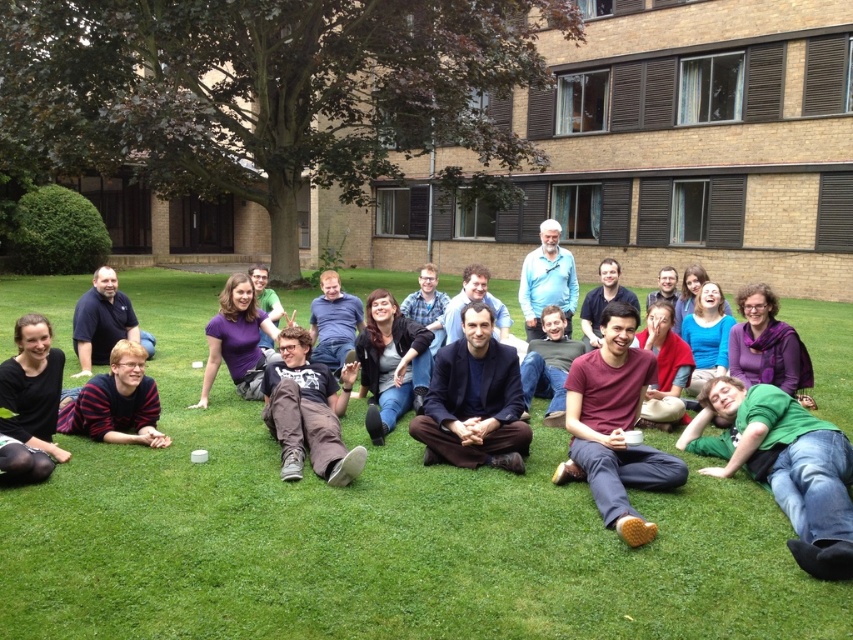
Can you confirm if green cotton shirt at lower right is smaller than dark blue fabric at center?

Incorrect, green cotton shirt at lower right is not smaller in size than dark blue fabric at center.

Does green cotton shirt at lower right come in front of dark blue fabric at center?

Yes, green cotton shirt at lower right is closer to the viewer.

This screenshot has height=640, width=853. What do you see at coordinates (784, 465) in the screenshot?
I see `green cotton shirt at lower right` at bounding box center [784, 465].

Locate an element on the screen. The height and width of the screenshot is (640, 853). green cotton shirt at lower right is located at coordinates click(x=784, y=465).

Can you confirm if green grass at center is positioned above green cotton shirt at lower right?

Yes, green grass at center is above green cotton shirt at lower right.

Can you confirm if green grass at center is bigger than green cotton shirt at lower right?

Yes.

Who is more distant from viewer, (198, 312) or (822, 477)?

Point (198, 312)

At what (x,y) coordinates should I click in order to perform the action: click on green grass at center. Please return your answer as a coordinate pair (x, y). The width and height of the screenshot is (853, 640). Looking at the image, I should click on (372, 534).

Does maroon cotton shirt at center appear on the right side of matte black shirt at left?

Yes, maroon cotton shirt at center is to the right of matte black shirt at left.

Image resolution: width=853 pixels, height=640 pixels. What are the coordinates of `maroon cotton shirt at center` in the screenshot? It's located at (614, 426).

Who is more forward, (587,438) or (109,321)?

Point (587,438)

Locate an element on the screen. maroon cotton shirt at center is located at coordinates pos(614,426).